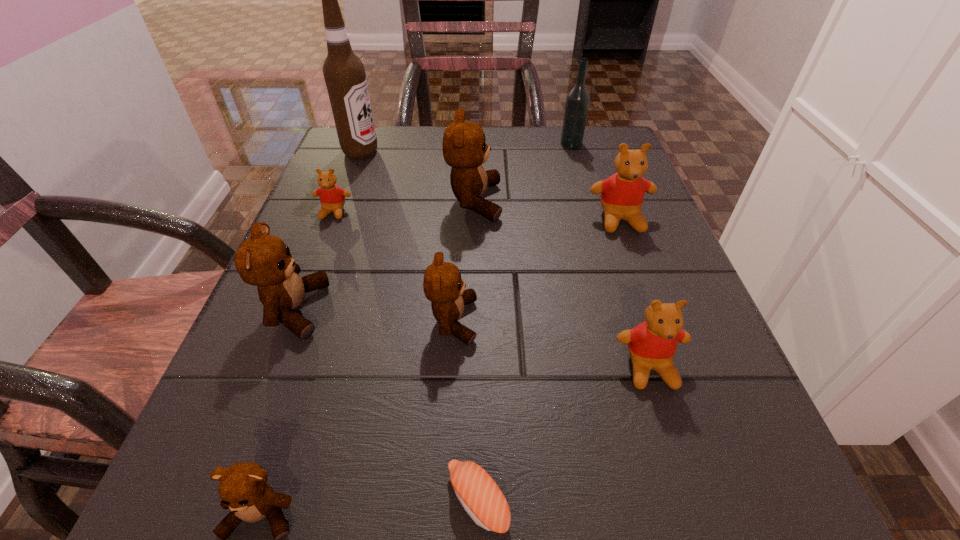
Where is `the tallest object`? The image size is (960, 540). the tallest object is located at coordinates coord(344,73).

At what (x,y) coordinates should I click in order to perform the action: click on vodka. Please return your answer as a coordinate pair (x, y). Looking at the image, I should click on (577, 101).

Image resolution: width=960 pixels, height=540 pixels. Identify the location of the biggest brown teddy bear. (464, 149).

At what (x,y) coordinates should I click in order to perform the action: click on the tallest teddy bear. Please return your answer as a coordinate pair (x, y). Image resolution: width=960 pixels, height=540 pixels. Looking at the image, I should click on (464, 149).

This screenshot has height=540, width=960. Find the location of `the second biggest brown teddy bear`. the second biggest brown teddy bear is located at coordinates (262, 260).

At what (x,y) coordinates should I click in order to perform the action: click on the biggest red teddy bear. Please return your answer as a coordinate pair (x, y). The height and width of the screenshot is (540, 960). Looking at the image, I should click on (622, 194).

I want to click on the second smallest brown teddy bear, so pos(443,286).

Locate an element on the screen. Image resolution: width=960 pixels, height=540 pixels. the nearest red teddy bear is located at coordinates (652, 344).

Where is `the leftmost red teddy bear`? The image size is (960, 540). the leftmost red teddy bear is located at coordinates (332, 198).

This screenshot has height=540, width=960. I want to click on salmon sushi, so click(480, 496).